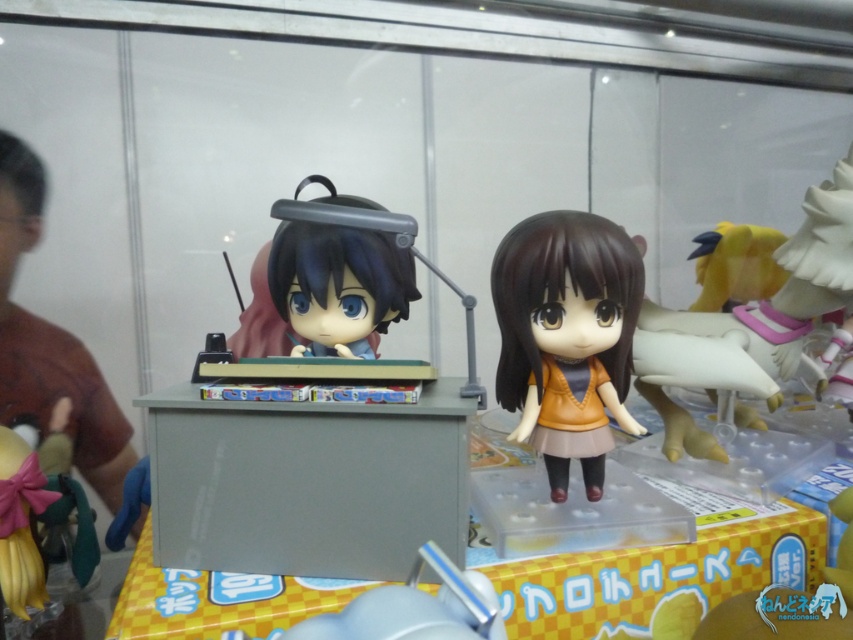
Question: Where is gray matte cabinet at center located in relation to satin black hair clip at center in the image?

Choices:
 (A) right
 (B) left

Answer: (B)

Question: Is gray matte cabinet at center smaller than brown matte doll at center?

Choices:
 (A) yes
 (B) no

Answer: (B)

Question: Does brown matte doll at center have a greater width compared to satin black hair clip at center?

Choices:
 (A) no
 (B) yes

Answer: (A)

Question: Which of the following is the farthest from the observer?

Choices:
 (A) (550, 276)
 (B) (318, 244)
 (C) (173, 458)
 (D) (723, 252)

Answer: (D)

Question: Estimate the real-world distances between objects in this image. Which object is farther from the brown matte doll at center?

Choices:
 (A) satin black hair clip at center
 (B) gray matte cabinet at center

Answer: (B)

Question: Which object is closer to the camera taking this photo?

Choices:
 (A) yellow matte plush toy at upper right
 (B) satin black hair clip at center

Answer: (B)